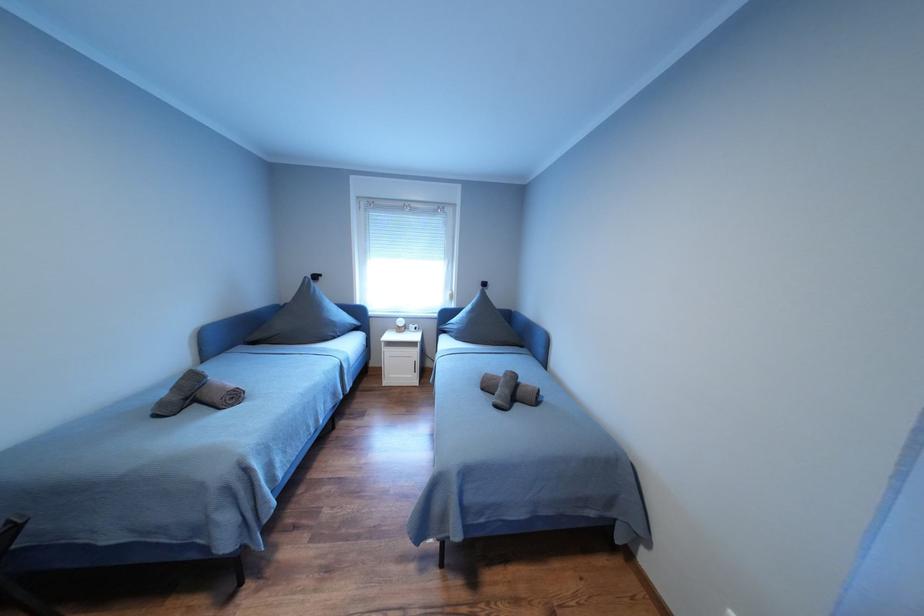
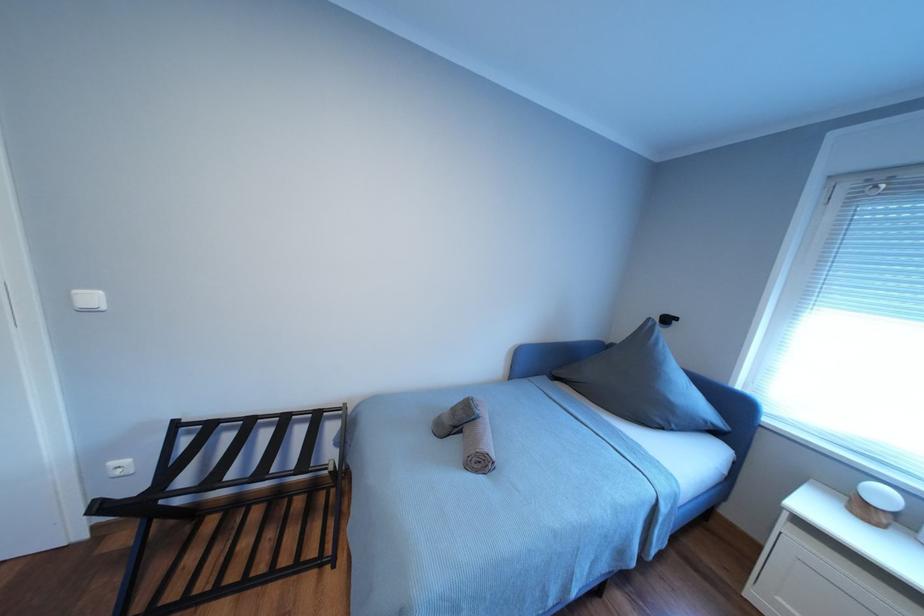
Question: The camera is either moving clockwise (left) or counter-clockwise (right) around the object. The first image is from the beginning of the video and the second image is from the end. Is the camera moving left or right when shooting the video?

Choices:
 (A) Left
 (B) Right

Answer: (B)